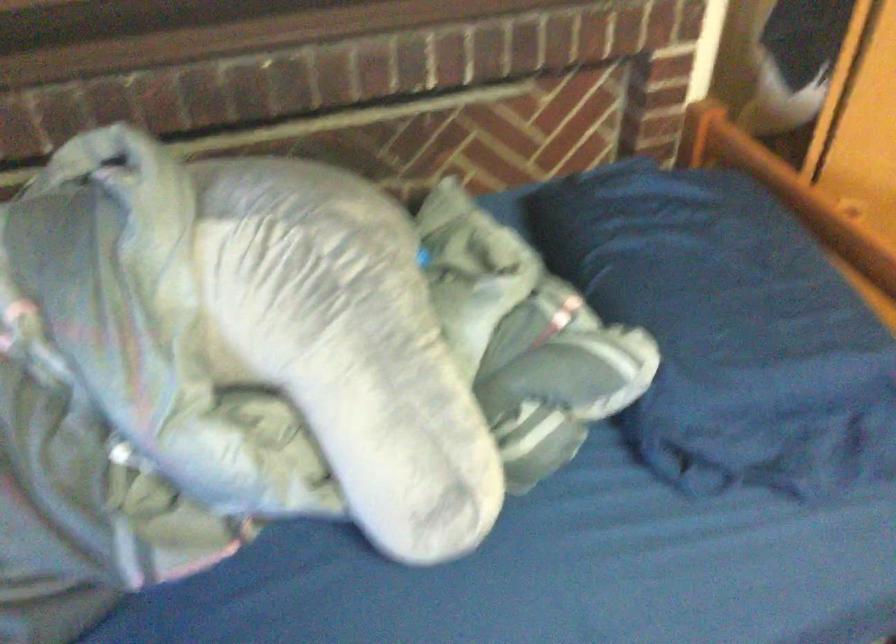
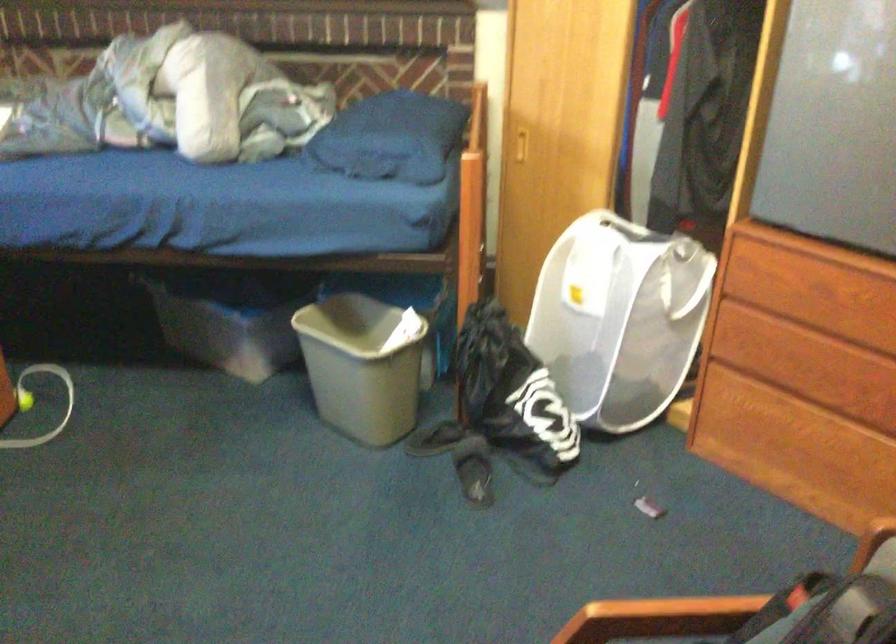
Which direction would the cameraman need to move to produce the second image?

The movement direction of the cameraman is right, backward.